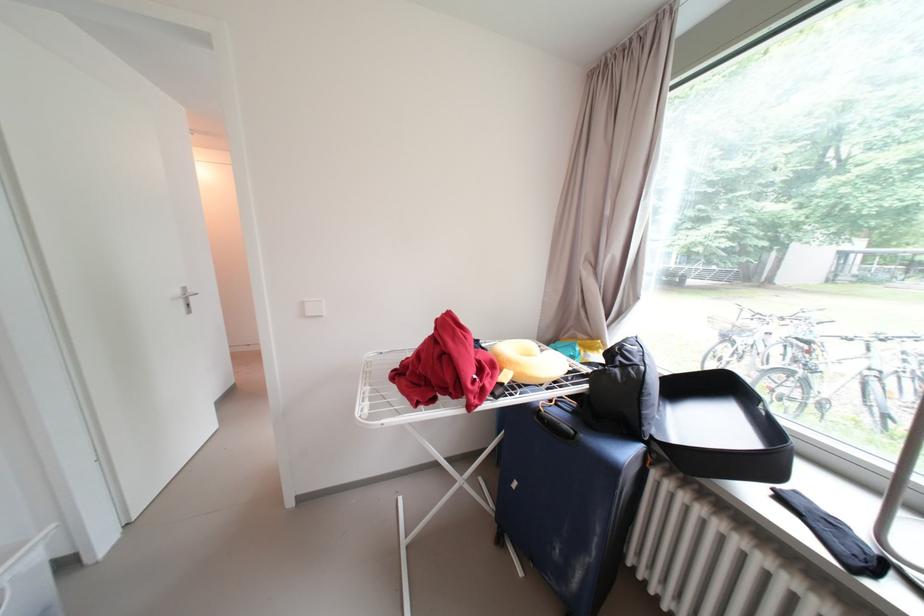
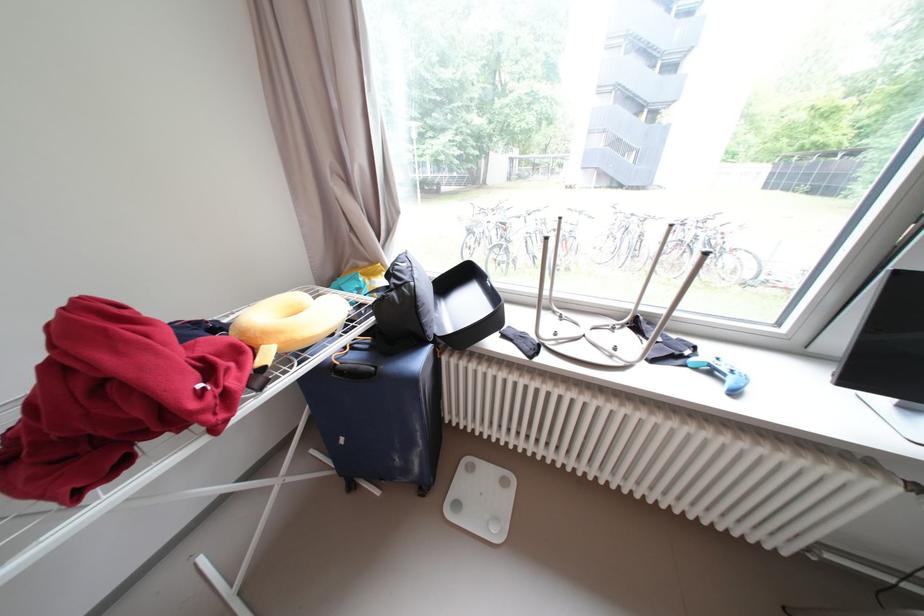
Where in the second image is the point corresponding to the point at 658,424 from the first image?

(439, 328)